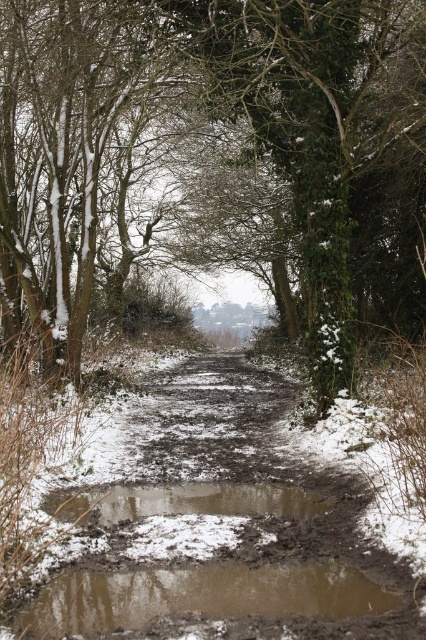
From the picture: You are hiking along the muddy wet path at center and want to avoid stepping into the brown muddy puddle at center. Which direction should you move to stay on the path and away from the puddle?

The muddy wet path at center is closer to the viewer than the brown muddy puddle at center, so you should move towards the direction of the path to stay on it and avoid the puddle behind it.

You are a hiker trying to cross the path without getting your boots too dirty. The muddy wet path at center and the brown muddy puddle at center are both in your way. Which one should you avoid stepping on to stay drier?

You should avoid stepping on the brown muddy puddle at center because the muddy wet path at center is above it, meaning the puddle is lower and likely holds more water, making it wetter.

You are a hiker carrying a backpack and need to cross the path. The muddy wet path at center has a brown muddy puddle at center nearby. Can you step over the puddle without getting your boots wet?

The distance between the muddy wet path at center and the brown muddy puddle at center is 25.60 inches. Since this distance is quite large, you would need to take a step of at least 25.60 inches to avoid stepping into the puddle, which might be difficult while carrying a backpack. Therefore, it might be safer to walk around the puddle if possible.